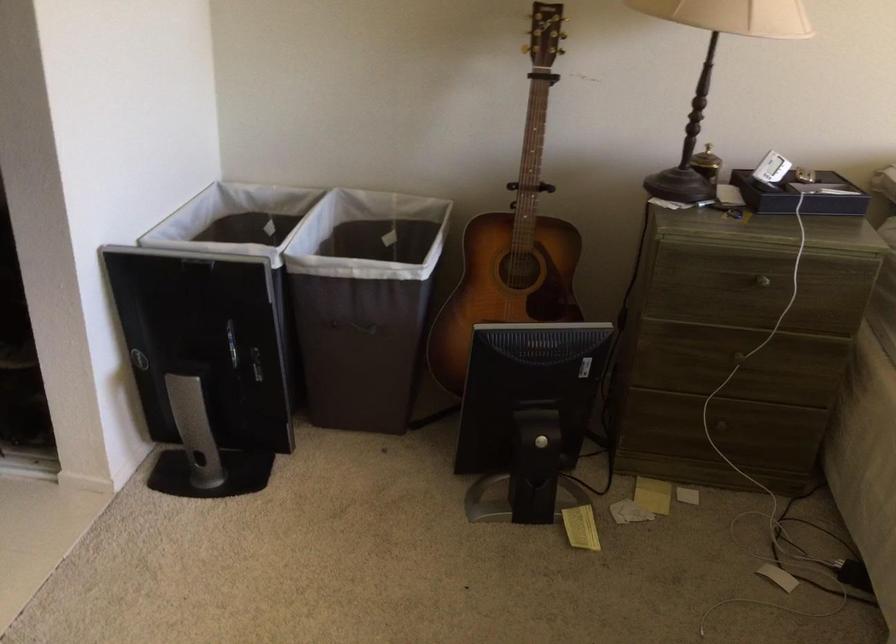
Locate an element on the screen. acoustic guitar is located at coordinates (513, 237).